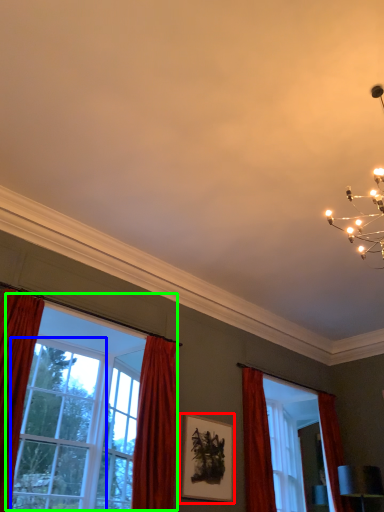
Question: Which is nearer to the picture frame (highlighted by a red box)? window (highlighted by a blue box) or window (highlighted by a green box).

Choices:
 (A) window
 (B) window

Answer: (B)